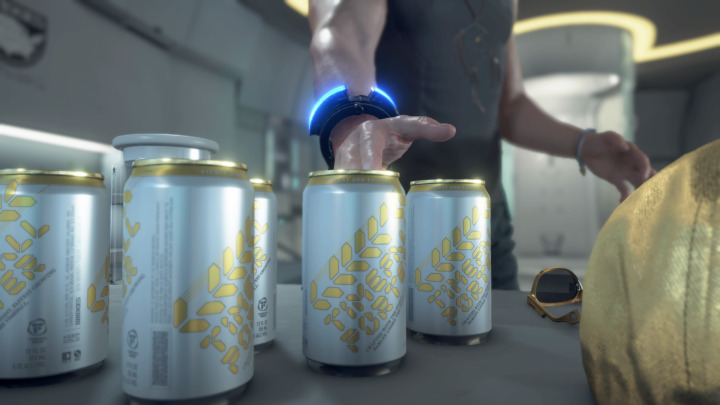
Find the location of a particular element. Image resolution: width=720 pixels, height=405 pixels. lighting is located at coordinates (582, 18), (702, 45).